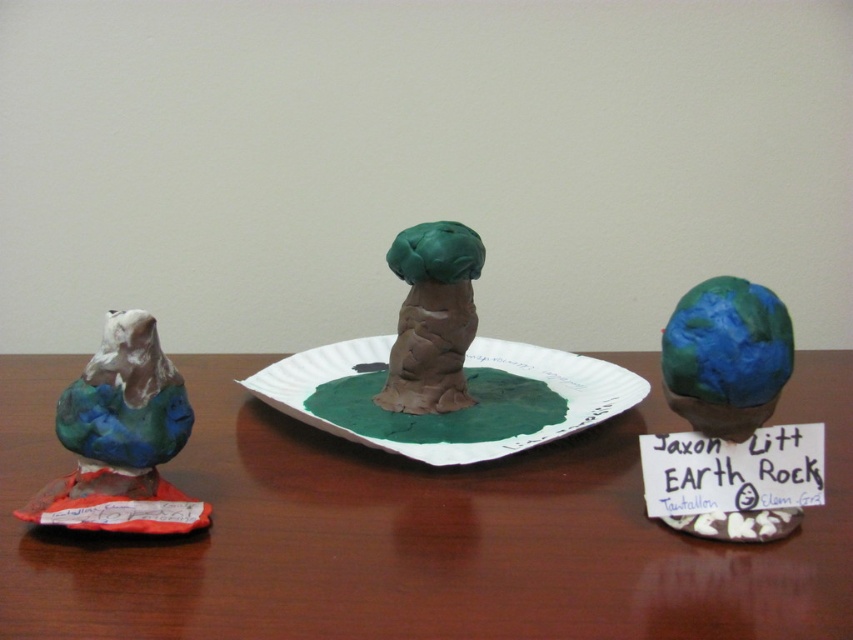
You are an art curator arranging the sculptures. The matte clay bird at left and the matte clay tree at center are part of an exhibit. From the perspective of a visitor standing directly in front of the display, which sculpture is positioned lower on the wooden surface?

The matte clay bird at left is located below the matte clay tree at center, so it is positioned lower on the wooden surface.

You are an art curator arranging these sculptures. The green paper plate at center and the matte clay tree at center are both on the same wooden surface. Which object has a greater width?

The green paper plate at center has a greater width than the matte clay tree at center according to the description.